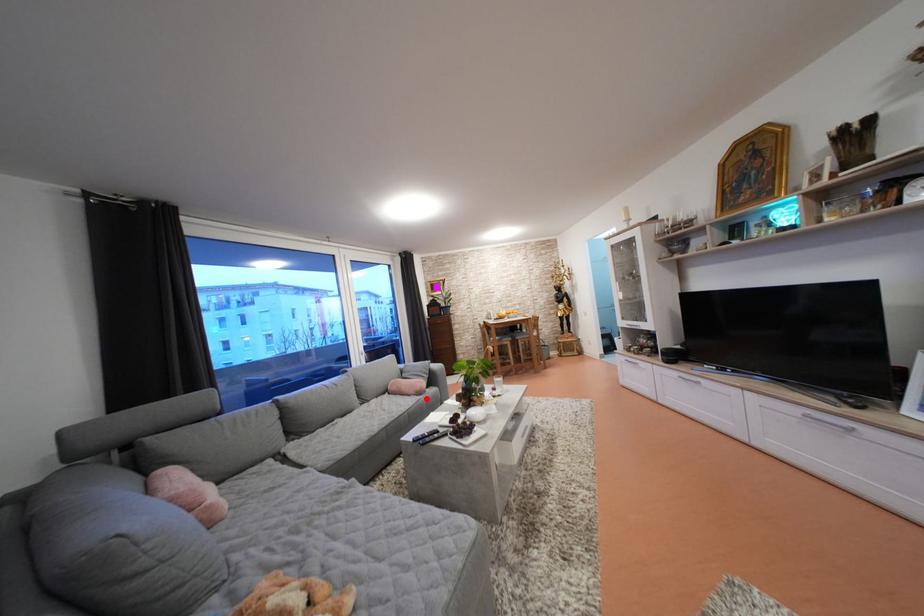
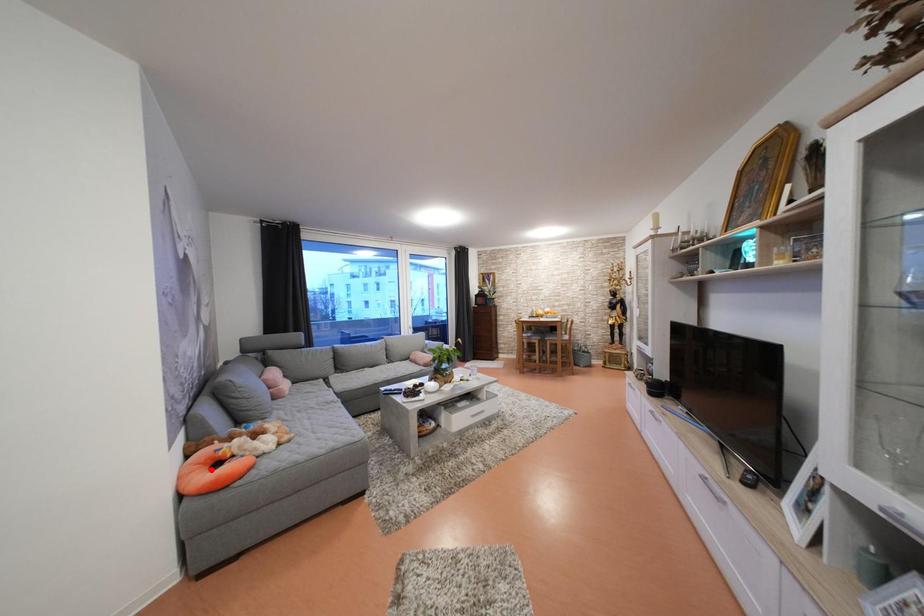
I am providing you with two images of the same scene from different viewpoints. A red point is marked on the first image and another point is marked on the second image. Does the point marked in image1 correspond to the same location as the one in image2?

No